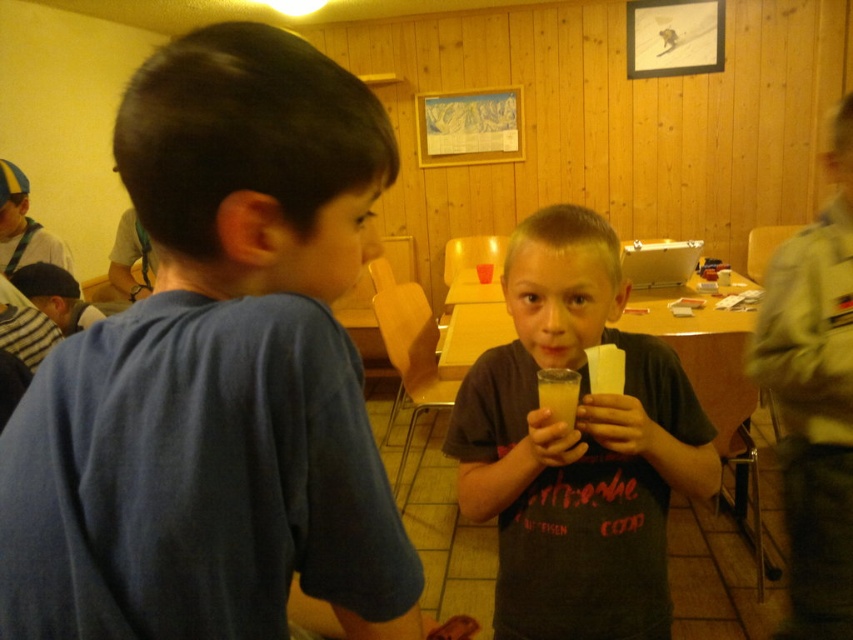
What is the location of the point with coordinates (218,372) in the image?

The point with coordinates (218,372) is located on the blue cotton shirt at upper left.

From the picture: You are a photographer setting up for a group photo in this scene. You need to arrange the blue cotton shirt at upper left and the matte gray shirt at center so that both are visible in the frame. Considering their heights, which shirt should you place closer to the camera to ensure both are fully visible?

The blue cotton shirt at upper left is shorter than the matte gray shirt at center. To ensure both are fully visible, place the shorter blue cotton shirt at upper left closer to the camera so its full height is captured without being blocked by the taller matte gray shirt at center.